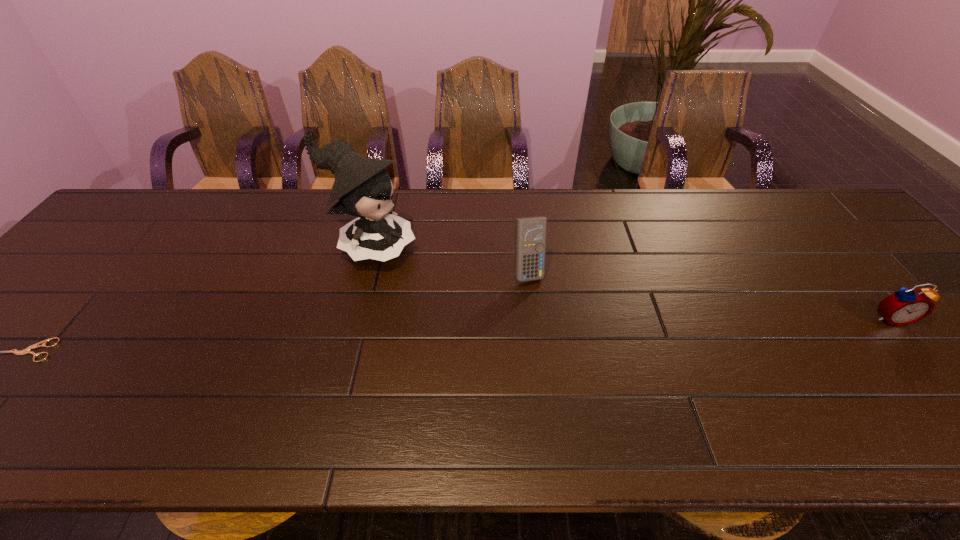
In order to click on free spot on the desktop that is between the leftmost object and the third tallest object and is positioned at the face of the doll in this screenshot , I will do coord(545,331).

At what (x,y) coordinates should I click in order to perform the action: click on free space on the desktop that is between the shears and the alarm clock and is positioned on the front-facing side of the calculator. Please return your answer as a coordinate pair (x, y). Looking at the image, I should click on [557, 330].